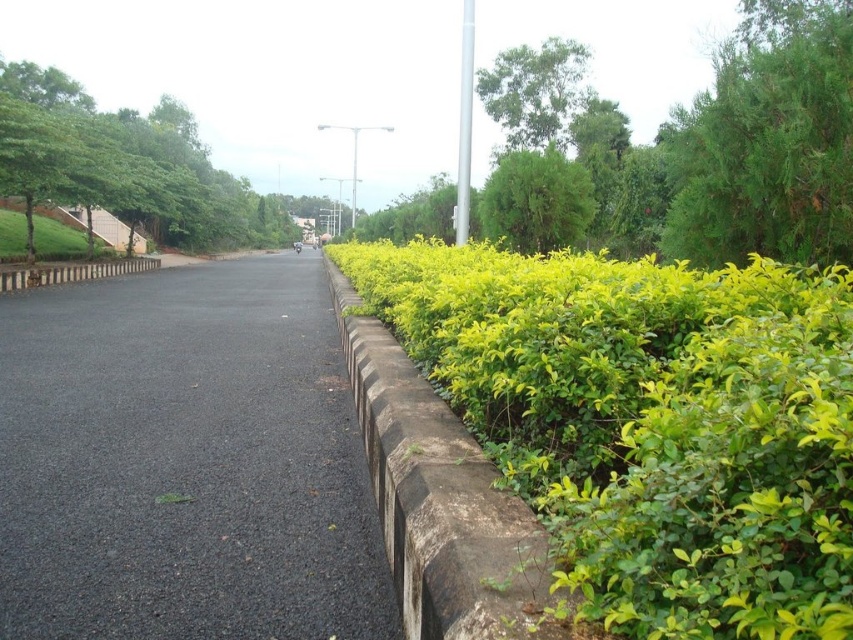
You are standing on the road and want to take a photo of both the point at (844, 360) and the point at (167, 140). Which point should you focus on first to ensure both are in sharp focus?

You should focus on the point at (844, 360) first because it is closer to the camera than the point at (167, 140). By focusing on the closer point, the farther point will also be within the depth of field and in focus.

What is the relationship between the size of the black asphalt pavement at center and the green leafy tree at left in the image?

The black asphalt pavement at center is smaller in size compared to the green leafy tree at left.